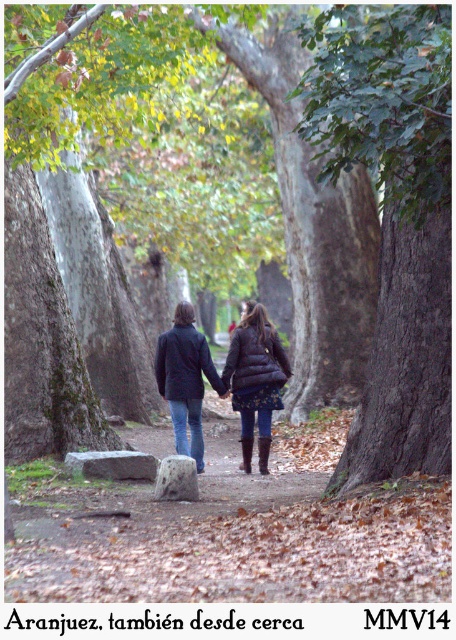
Question: Which point appears farthest from the camera in this image?

Choices:
 (A) pyautogui.click(x=387, y=301)
 (B) pyautogui.click(x=269, y=339)

Answer: (B)

Question: Is brown rough bark tree at center thinner than matte black jackets at center?

Choices:
 (A) no
 (B) yes

Answer: (B)

Question: Observing the image, what is the correct spatial positioning of brown rough bark tree at center in reference to matte black jackets at center?

Choices:
 (A) above
 (B) below

Answer: (A)

Question: Which point is farther from the camera taking this photo?

Choices:
 (A) (336, 49)
 (B) (245, 387)

Answer: (B)

Question: Does brown rough bark tree at center have a smaller size compared to matte black jackets at center?

Choices:
 (A) no
 (B) yes

Answer: (A)

Question: Among these objects, which one is farthest from the camera?

Choices:
 (A) brown rough bark tree at center
 (B) matte black jackets at center

Answer: (B)